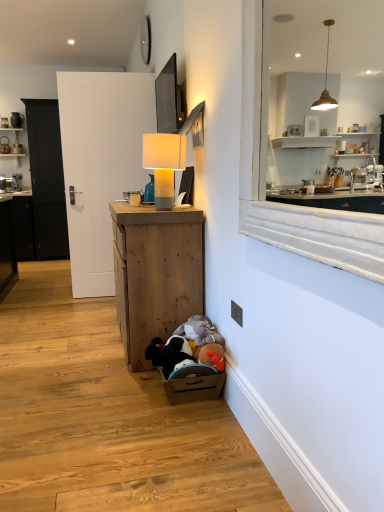
At what (x,y) coordinates should I click in order to perform the action: click on white wooden door at center. Please return your answer as a coordinate pair (x, y). This screenshot has height=512, width=384. Looking at the image, I should click on (100, 163).

In order to click on white marble window at upper right in this screenshot , I will do `click(265, 170)`.

The image size is (384, 512). What do you see at coordinates (237, 313) in the screenshot?
I see `black plastic electric outlet at lower right` at bounding box center [237, 313].

This screenshot has height=512, width=384. I want to click on white wooden door at center, so click(100, 163).

Is wooden cabinet at lower center at the back of black plastic electric outlet at lower right?

No, black plastic electric outlet at lower right is not facing the opposite direction of wooden cabinet at lower center.

In the scene shown: Is black plastic electric outlet at lower right in front of or behind wooden cabinet at lower center in the image?

In the image, black plastic electric outlet at lower right appears in front of wooden cabinet at lower center.

Does point (231, 314) lie behind point (120, 332)?

No, (231, 314) is closer to viewer.

Considering the positions of objects wooden cabinet at lower center and white wooden door at center in the image provided, who is behind, wooden cabinet at lower center or white wooden door at center?

white wooden door at center is behind.

Considering the sizes of objects wooden cabinet at lower center and white wooden door at center in the image provided, who is bigger, wooden cabinet at lower center or white wooden door at center?

wooden cabinet at lower center is bigger.

From a real-world perspective, is wooden cabinet at lower center located higher than white wooden door at center?

No, from a real-world perspective, wooden cabinet at lower center is not on top of white wooden door at center.

From the image's perspective, would you say wooden cabinet at lower center is shown under white wooden door at center?

Correct, wooden cabinet at lower center appears lower than white wooden door at center in the image.

How much distance is there between matte gray table lamp at center and white marble window at upper right?

matte gray table lamp at center is 29.71 inches from white marble window at upper right.

Considering the sizes of objects matte gray table lamp at center and white marble window at upper right in the image provided, who is bigger, matte gray table lamp at center or white marble window at upper right?

Bigger between the two is white marble window at upper right.

From a real-world perspective, is matte gray table lamp at center beneath white marble window at upper right?

Yes, from a real-world perspective, matte gray table lamp at center is beneath white marble window at upper right.

Is matte gray table lamp at center inside or outside of white marble window at upper right?

The correct answer is: outside.

Is white wooden door at center wider or thinner than matte gray table lamp at center?

white wooden door at center is thinner than matte gray table lamp at center.

Which is closer to the camera, [70,203] or [161,188]?

Clearly, point [70,203] is more distant from the camera than point [161,188].

From the image's perspective, which is below, white wooden door at center or matte gray table lamp at center?

matte gray table lamp at center is shown below in the image.

Consider the image. Is white wooden door at center touching matte gray table lamp at center?

white wooden door at center is not next to matte gray table lamp at center, and they're not touching.

Which object is wider, white marble window at upper right or white wooden door at center?

Wider between the two is white wooden door at center.

Does point (316, 248) appear closer or farther from the camera than point (72, 236)?

Point (316, 248) is closer to the camera than point (72, 236).

Consider the image. Which is more to the right, white marble window at upper right or white wooden door at center?

From the viewer's perspective, white marble window at upper right appears more on the right side.

Which is behind, white marble window at upper right or white wooden door at center?

white wooden door at center is behind.

Looking at this image, considering the relative sizes of wooden cabinet at lower center and matte gray table lamp at center in the image provided, is wooden cabinet at lower center taller than matte gray table lamp at center?

Correct, wooden cabinet at lower center is much taller as matte gray table lamp at center.

Is wooden cabinet at lower center directly adjacent to matte gray table lamp at center?

No, wooden cabinet at lower center is not beside matte gray table lamp at center.

From a real-world perspective, is wooden cabinet at lower center physically located above or below matte gray table lamp at center?

Clearly, from a real-world perspective, wooden cabinet at lower center is below matte gray table lamp at center.

Locate an element on the screen. cabinetry on the left side of matte gray table lamp at center is located at coordinates (155, 273).

Is matte gray table lamp at center to the right of black plastic electric outlet at lower right from the viewer's perspective?

No, matte gray table lamp at center is not to the right of black plastic electric outlet at lower right.

Between matte gray table lamp at center and black plastic electric outlet at lower right, which one has more height?

matte gray table lamp at center is taller.

Which object is further away from the camera taking this photo, matte gray table lamp at center or black plastic electric outlet at lower right?

matte gray table lamp at center is further from the camera.

Locate an element on the screen. electric outlet in front of the wooden cabinet at lower center is located at coordinates (237, 313).

This screenshot has height=512, width=384. Find the location of `door behind the wooden cabinet at lower center`. door behind the wooden cabinet at lower center is located at coordinates (100, 163).

Looking at the image, which one is located further to black plastic electric outlet at lower right, white wooden door at center or wooden cabinet at lower center?

white wooden door at center lies further to black plastic electric outlet at lower right than the other object.

Considering their positions, is black plastic electric outlet at lower right positioned closer to white wooden door at center than wooden cabinet at lower center?

The object closer to white wooden door at center is wooden cabinet at lower center.

Based on their spatial positions, is white wooden door at center or black plastic electric outlet at lower right closer to wooden cabinet at lower center?

Among the two, black plastic electric outlet at lower right is located nearer to wooden cabinet at lower center.

From the image, which object appears to be nearer to white marble window at upper right, black plastic electric outlet at lower right or white wooden door at center?

black plastic electric outlet at lower right.

Considering their positions, is white wooden door at center positioned closer to matte gray table lamp at center than wooden cabinet at lower center?

The object closer to matte gray table lamp at center is wooden cabinet at lower center.

Estimate the real-world distances between objects in this image. Which object is further from matte gray table lamp at center, black plastic electric outlet at lower right or white marble window at upper right?

black plastic electric outlet at lower right is positioned further to the anchor matte gray table lamp at center.

Estimate the real-world distances between objects in this image. Which object is closer to wooden cabinet at lower center, white wooden door at center or white marble window at upper right?

white marble window at upper right.

Which object lies nearer to the anchor point matte gray table lamp at center, wooden cabinet at lower center or white marble window at upper right?

Based on the image, wooden cabinet at lower center appears to be nearer to matte gray table lamp at center.

I want to click on cabinetry between matte gray table lamp at center and black plastic electric outlet at lower right from top to bottom, so click(155, 273).

This screenshot has height=512, width=384. In order to click on table lamp located between black plastic electric outlet at lower right and white wooden door at center in the depth direction in this screenshot , I will do `click(164, 164)`.

The image size is (384, 512). I want to click on electric outlet between white marble window at upper right and white wooden door at center from front to back, so click(x=237, y=313).

Where is `cabinetry positioned between white marble window at upper right and white wooden door at center from near to far`? This screenshot has height=512, width=384. cabinetry positioned between white marble window at upper right and white wooden door at center from near to far is located at coordinates (155, 273).